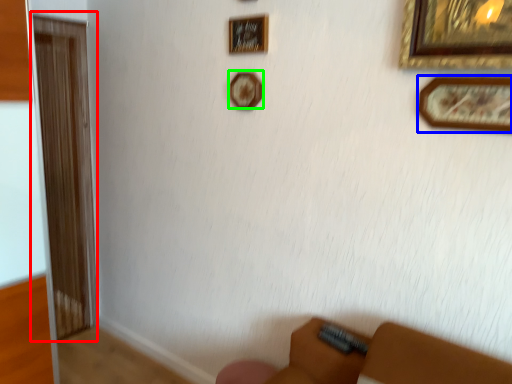
Question: Which object is positioned farthest from screen door (highlighted by a red box)? Select from picture frame (highlighted by a blue box) and picture frame (highlighted by a green box).

Choices:
 (A) picture frame
 (B) picture frame

Answer: (A)